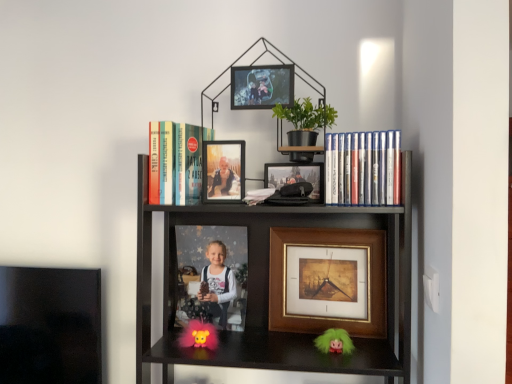
Question: From the image's perspective, is matte plastic photo frame at center, the third picture frame when ordered from top to bottom, under fluffy pink toy at center?

Choices:
 (A) yes
 (B) no

Answer: (B)

Question: Does matte plastic photo frame at center, which ranks as the fourth picture frame in front-to-back order, appear on the left side of fluffy pink toy at center?

Choices:
 (A) no
 (B) yes

Answer: (A)

Question: From a real-world perspective, does matte plastic photo frame at center, which ranks as the fourth picture frame in front-to-back order, stand above fluffy pink toy at center?

Choices:
 (A) yes
 (B) no

Answer: (A)

Question: Does matte plastic photo frame at center, acting as the 2th picture frame starting from the bottom, lie in front of fluffy pink toy at center?

Choices:
 (A) yes
 (B) no

Answer: (B)

Question: Is matte plastic photo frame at center, acting as the 2th picture frame starting from the bottom, beside fluffy pink toy at center?

Choices:
 (A) yes
 (B) no

Answer: (B)

Question: From the image's perspective, is gold/glossy picture frame at center, which is counted as the 3th picture frame, starting from the front, located above or below green fuzzy doll at lower center?

Choices:
 (A) above
 (B) below

Answer: (A)

Question: Which is correct: gold/glossy picture frame at center, positioned as the 4th picture frame in top-to-bottom order, is inside green fuzzy doll at lower center, or outside of it?

Choices:
 (A) outside
 (B) inside

Answer: (A)

Question: In terms of size, does gold/glossy picture frame at center, which is counted as the 3th picture frame, starting from the front, appear bigger or smaller than green fuzzy doll at lower center?

Choices:
 (A) small
 (B) big

Answer: (B)

Question: Relative to green fuzzy doll at lower center, is gold/glossy picture frame at center, positioned as the 4th picture frame in top-to-bottom order, in front or behind?

Choices:
 (A) behind
 (B) front

Answer: (A)

Question: Is gold/glossy picture frame at center, which is counted as the first picture frame, starting from the bottom, wider or thinner than fluffy pink toy at center?

Choices:
 (A) wide
 (B) thin

Answer: (B)

Question: Is point (292, 258) closer or farther from the camera than point (211, 329)?

Choices:
 (A) farther
 (B) closer

Answer: (A)

Question: From the image's perspective, is gold/glossy picture frame at center, which is counted as the first picture frame, starting from the bottom, above or below fluffy pink toy at center?

Choices:
 (A) below
 (B) above

Answer: (B)

Question: Is gold/glossy picture frame at center, which is counted as the 3th picture frame, starting from the front, in front of or behind fluffy pink toy at center in the image?

Choices:
 (A) behind
 (B) front

Answer: (A)

Question: Is green fuzzy doll at lower center wider or thinner than matte plastic photo frame at center, the third picture frame when ordered from top to bottom?

Choices:
 (A) thin
 (B) wide

Answer: (A)

Question: Choose the correct answer: Is green fuzzy doll at lower center inside matte plastic photo frame at center, which ranks as the fourth picture frame in front-to-back order, or outside it?

Choices:
 (A) outside
 (B) inside

Answer: (A)